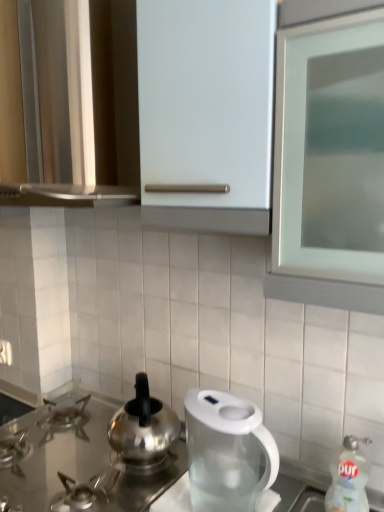
Question: Can you confirm if matte white cabinet at upper center is positioned to the left of polished stainless steel kettle at center?

Choices:
 (A) no
 (B) yes

Answer: (B)

Question: Is matte white cabinet at upper center touching polished stainless steel kettle at center?

Choices:
 (A) no
 (B) yes

Answer: (A)

Question: Does matte white cabinet at upper center have a larger size compared to polished stainless steel kettle at center?

Choices:
 (A) yes
 (B) no

Answer: (A)

Question: Is the depth of matte white cabinet at upper center greater than that of polished stainless steel kettle at center?

Choices:
 (A) yes
 (B) no

Answer: (B)

Question: Does matte white cabinet at upper center appear on the right side of polished stainless steel kettle at center?

Choices:
 (A) no
 (B) yes

Answer: (A)

Question: Is matte white cabinet at upper center turned away from polished stainless steel kettle at center?

Choices:
 (A) no
 (B) yes

Answer: (A)

Question: From a real-world perspective, is satin silver gas stove at lower left over matte white cabinet at upper center?

Choices:
 (A) no
 (B) yes

Answer: (A)

Question: Considering the relative positions of satin silver gas stove at lower left and matte white cabinet at upper center in the image provided, is satin silver gas stove at lower left behind matte white cabinet at upper center?

Choices:
 (A) no
 (B) yes

Answer: (B)

Question: Does satin silver gas stove at lower left have a lesser height compared to matte white cabinet at upper center?

Choices:
 (A) yes
 (B) no

Answer: (A)

Question: Is there a large distance between satin silver gas stove at lower left and matte white cabinet at upper center?

Choices:
 (A) no
 (B) yes

Answer: (A)

Question: Can you see satin silver gas stove at lower left touching matte white cabinet at upper center?

Choices:
 (A) yes
 (B) no

Answer: (B)

Question: From the image's perspective, is satin silver gas stove at lower left over matte white cabinet at upper center?

Choices:
 (A) no
 (B) yes

Answer: (A)

Question: Does polished stainless steel kettle at center have a smaller size compared to satin silver gas stove at lower left?

Choices:
 (A) no
 (B) yes

Answer: (B)